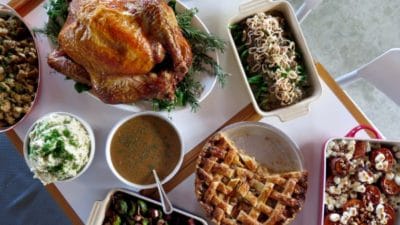
This screenshot has width=400, height=225. What are the coordinates of `floor` in the screenshot? It's located at (373, 45).